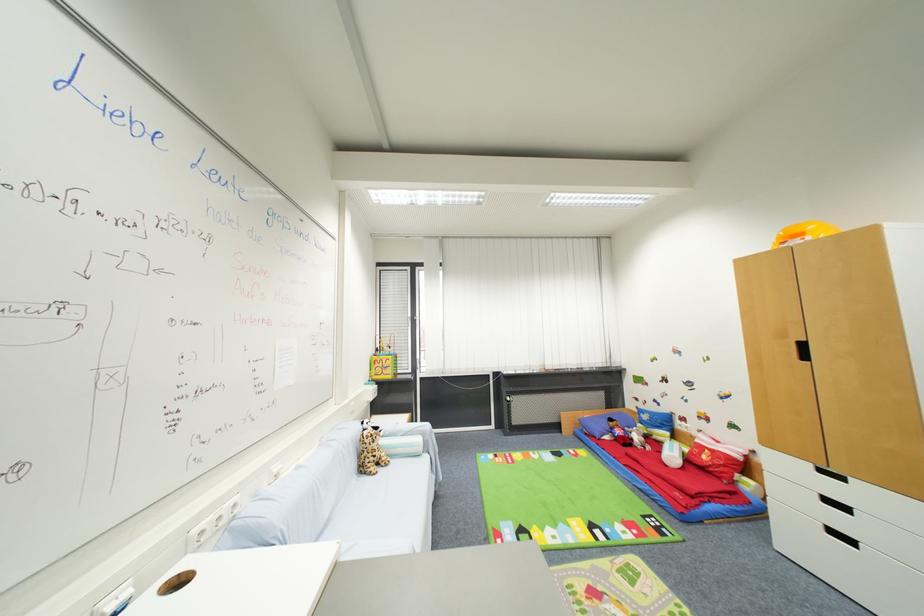
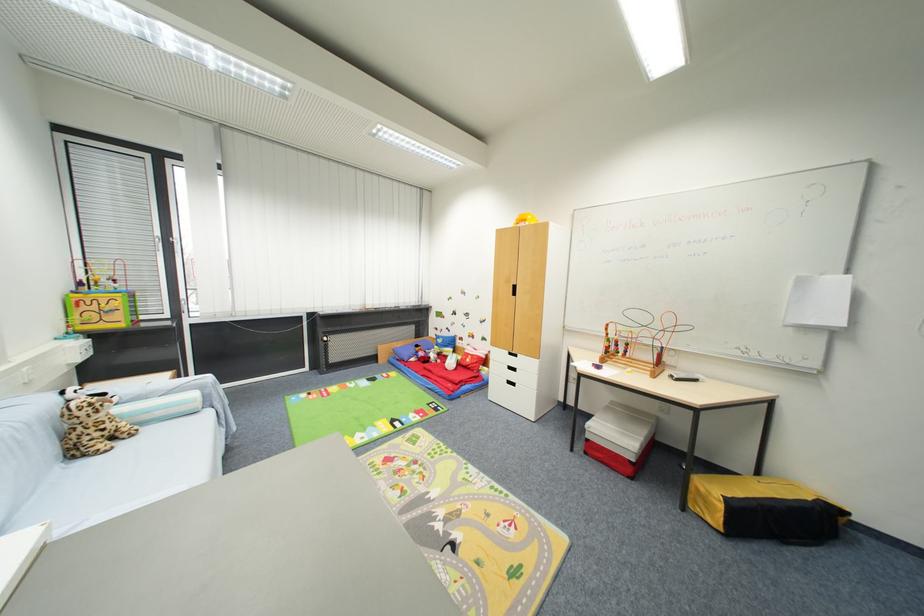
Question: The images are taken continuously from a first-person perspective. In which direction is your viewpoint rotating?

Choices:
 (A) Left
 (B) Right
 (C) Up
 (D) Down

Answer: (B)